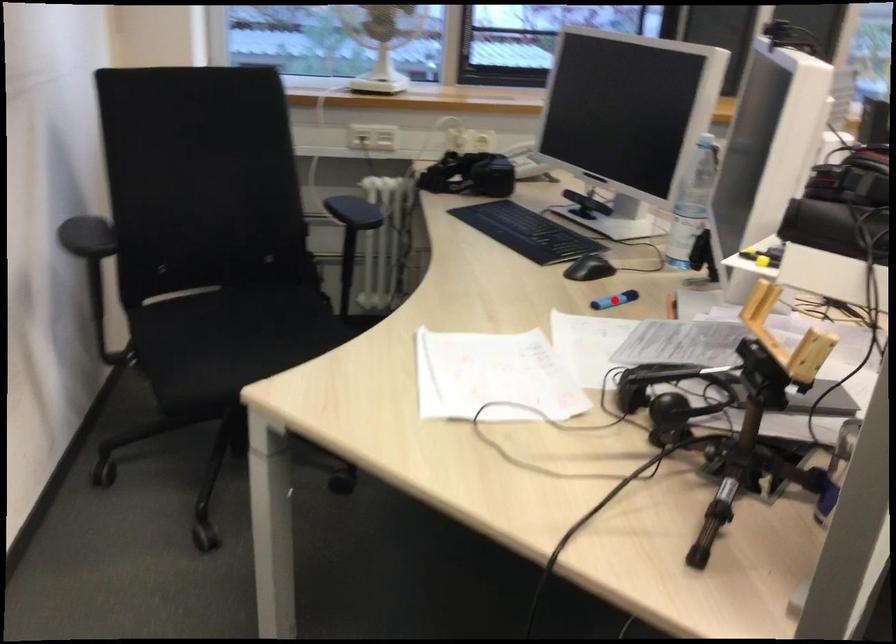
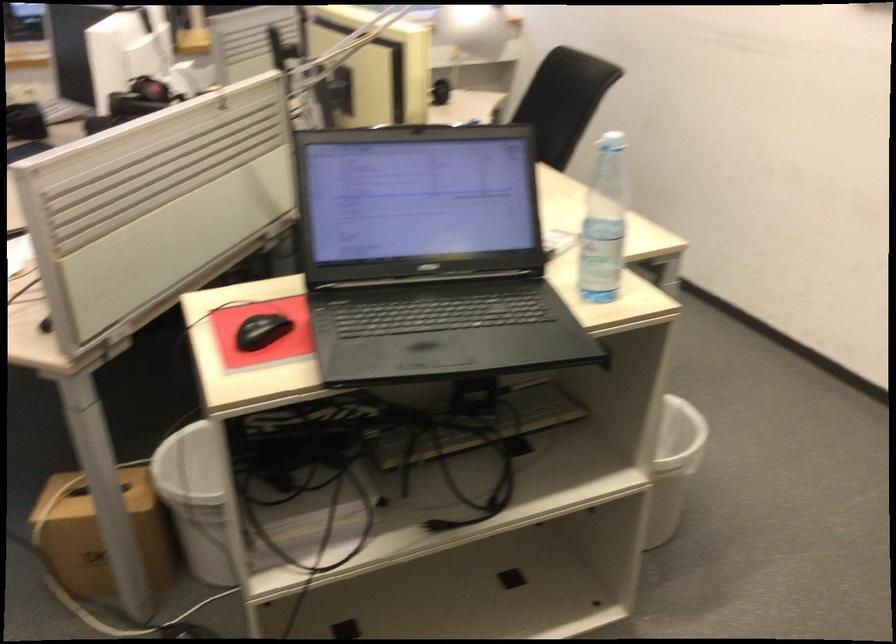
Question: I am providing you with two images of the same scene from different viewpoints. A red point is marked on the first image. Can you still see the location of the red point in image 2?

Choices:
 (A) Yes
 (B) No

Answer: (B)